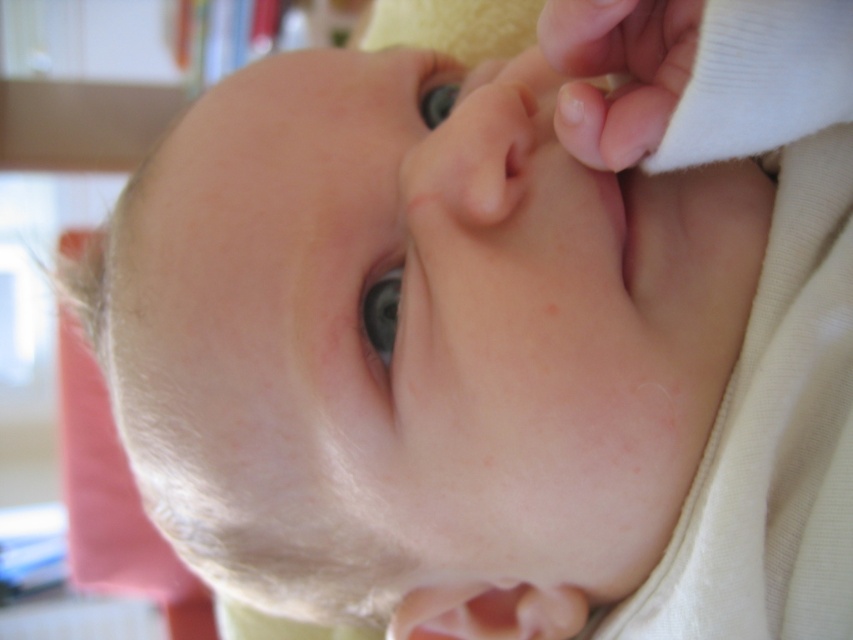
You are a photographer adjusting lighting for a baby portrait. You notice the smooth skin hand at upper right and the blue glossy eye at center in your frame. Which object should you focus on to ensure proper exposure if the hand is in shadow and the eye is well lit?

The smooth skin hand at upper right requires more attention because it has a larger size compared to the blue glossy eye at center and is in shadow, so adjusting lighting here would balance the exposure.

You are a photographer adjusting your camera settings. You notice the smooth flesh nose at center and the blue glossy eye at center in your viewfinder. Which object is positioned closer to your camera lens?

The smooth flesh nose at center is closer to the viewer than the blue glossy eye at center, so the smooth flesh nose at center is positioned closer to the camera lens.